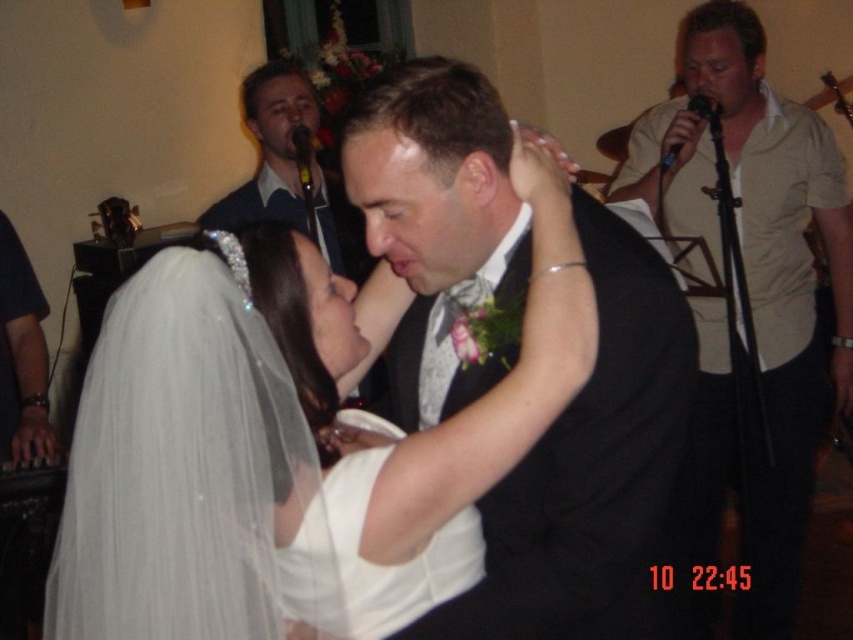
Question: Which of the following is the closest to the observer?

Choices:
 (A) beige shirt at upper right
 (B) white satin dress at center
 (C) matte black suit at upper center

Answer: (B)

Question: Which point is farther to the camera?

Choices:
 (A) matte black suit at upper center
 (B) white satin dress at center
 (C) black satin suit at center
 (D) beige shirt at upper right

Answer: (A)

Question: Is white satin dress at center thinner than matte black suit at upper center?

Choices:
 (A) yes
 (B) no

Answer: (A)

Question: Does beige shirt at upper right have a larger size compared to matte black suit at upper center?

Choices:
 (A) no
 (B) yes

Answer: (B)

Question: Is black satin suit at center positioned behind beige shirt at upper right?

Choices:
 (A) yes
 (B) no

Answer: (B)

Question: Which object appears closest to the camera in this image?

Choices:
 (A) black satin suit at center
 (B) white satin dress at center
 (C) matte black suit at upper center

Answer: (B)